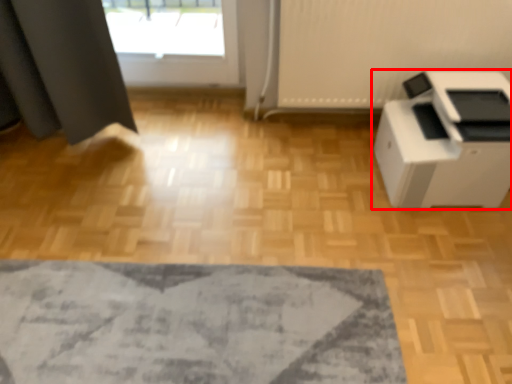
Question: Considering the relative positions of home appliance (annotated by the red box) and mat in the image provided, where is home appliance (annotated by the red box) located with respect to the staircase?

Choices:
 (A) right
 (B) left

Answer: (A)